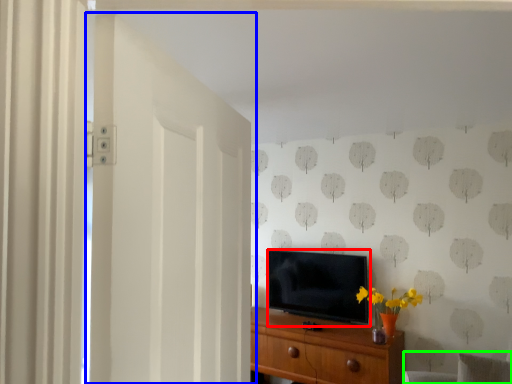
Question: Which object is the farthest from television (highlighted by a red box)? Choose among these: door (highlighted by a blue box) or swivel chair (highlighted by a green box).

Choices:
 (A) door
 (B) swivel chair

Answer: (A)